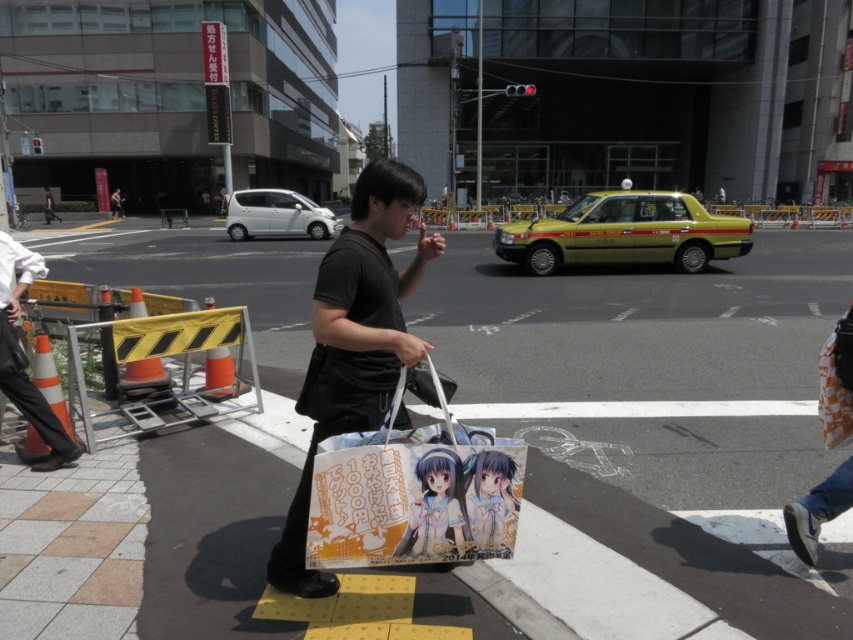
You are standing at the crosswalk and want to take a photo of the yellow taxi. The camera you are using has a focal length of 50mm and a sensor size of 24mm x 36mm. The point where you want to focus, point (456, 541), is 2.67 meters away from the camera. What is the minimum distance you need to move backward so that the yellow taxi fills the entire frame vertically?

To determine the minimum distance to move backward, first calculate the required distance using the sensor size and focal length. The sensor height is 24mm. The formula for the required distance is focal length multiplied by the sensor height divided by the object height. However, since the object height isn not provided, we can use the given distance to the point. The point is 2.67 meters away. To fill the frame vertically, the distance should be such that the taxi height fits within the sensor. Without an